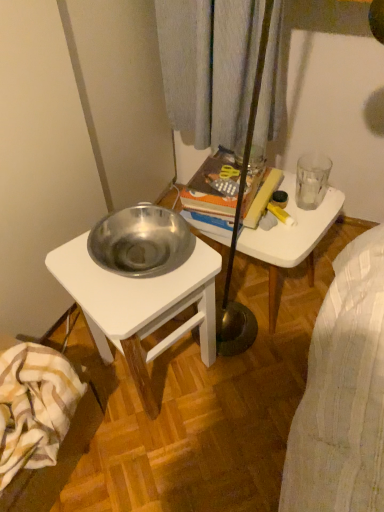
Question: From the image's perspective, is transparent glass at upper right located above or below striped cotton blanket at lower left?

Choices:
 (A) above
 (B) below

Answer: (A)

Question: From a real-world perspective, is transparent glass at upper right physically located above or below striped cotton blanket at lower left?

Choices:
 (A) above
 (B) below

Answer: (A)

Question: Estimate the real-world distances between objects in this image. Which object is closer to the polished silver bowl at left?

Choices:
 (A) orange hardcover book at center
 (B) striped cotton blanket at lower left
 (C) white glossy table at upper center
 (D) transparent glass at upper right

Answer: (B)

Question: Estimate the real-world distances between objects in this image. Which object is farther from the white glossy table at upper center?

Choices:
 (A) striped cotton blanket at lower left
 (B) polished silver bowl at left
 (C) transparent glass at upper right
 (D) orange hardcover book at center

Answer: (A)